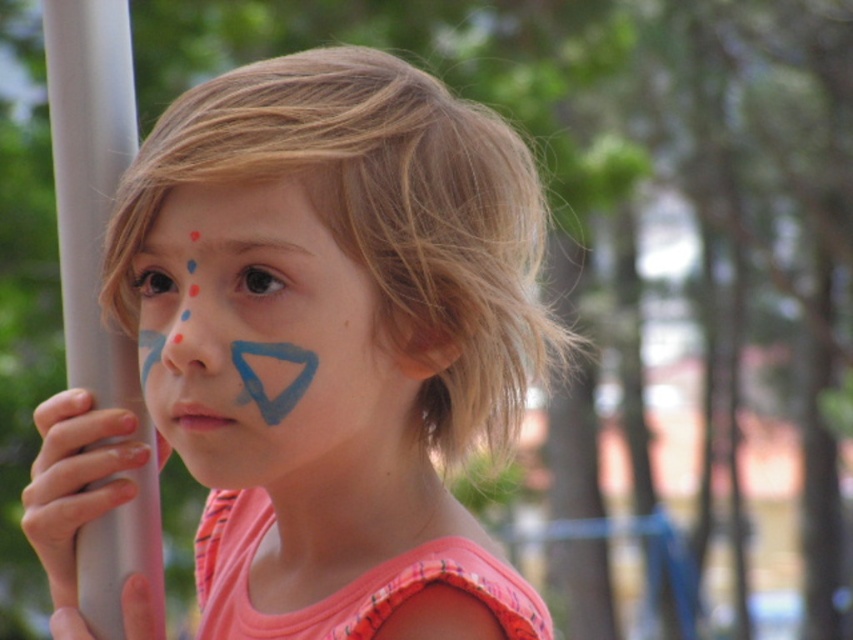
You are a photographer setting up a shot of the child. The blue matte triangle at center and the smooth gray pole at left are both in the frame. Which object appears taller in the photo?

The blue matte triangle at center appears taller than the smooth gray pole at left in the photo.

You are a parent trying to decide which pole to hold your child near. Both the white plastic pole at left and the smooth gray pole at left are in the scene. Which pole is closer to you?

The white plastic pole at left is closer to you because the smooth gray pole at left is behind it.

Looking at this image, you are a makeup artist who needs to apply the blue matte triangle at center on a child. The child is 36 inches tall. What is the minimum height of the step stool needed to reach the child?

The blue matte triangle at center is 30.90 inches apart from the child. Therefore, the step stool must be at least 30.90 inches tall to allow the makeup artist to reach the child.